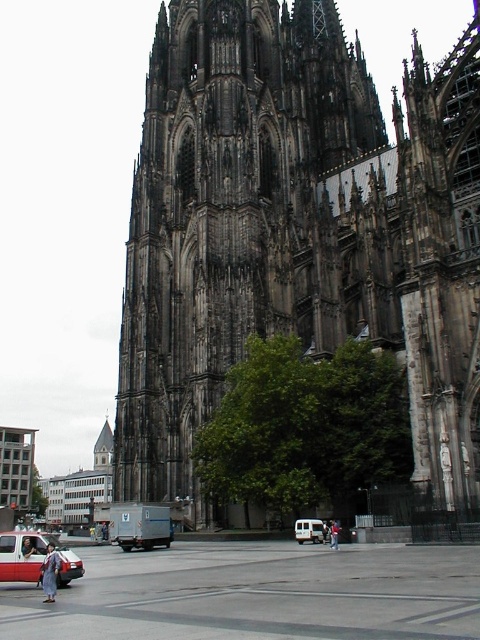
Which is below, matte red car at lower left or white matte van at center?

matte red car at lower left is below.

Between point (12, 538) and point (301, 531), which one is positioned behind?

Positioned behind is point (301, 531).

Is point (34, 554) farther from viewer compared to point (320, 529)?

No, it is in front of (320, 529).

Locate an element on the screen. matte red car at lower left is located at coordinates (34, 557).

Who is higher up, dark stone church at center or matte red car at lower left?

dark stone church at center is above.

Can you confirm if dark stone church at center is thinner than matte red car at lower left?

No, dark stone church at center is not thinner than matte red car at lower left.

Where is `dark stone church at center`? The image size is (480, 640). dark stone church at center is located at coordinates (297, 230).

Between point (286, 289) and point (312, 540), which one is positioned in front?

Point (312, 540) is more forward.

Can you confirm if dark stone church at center is smaller than white matte van at center?

Actually, dark stone church at center might be larger than white matte van at center.

Between point (249, 269) and point (320, 538), which one is positioned in front?

Point (320, 538)

Image resolution: width=480 pixels, height=640 pixels. Identify the location of dark stone church at center. (297, 230).